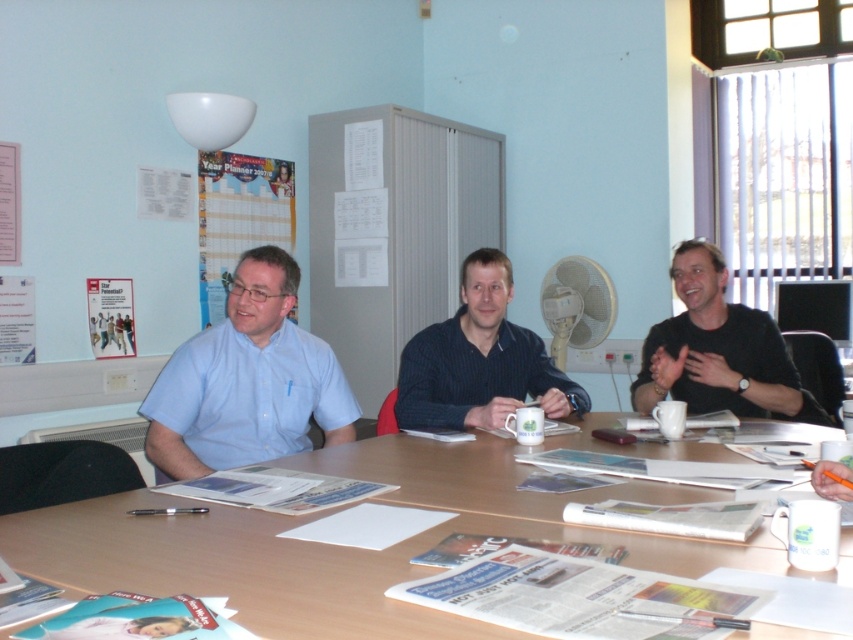
You are a photographer standing at the back of the room. You want to take a clear photo of the light blue shirt at center and the dark blue textured shirt at center. Which shirt should you focus on first to ensure both are in focus?

You should focus on the light blue shirt at center first since it is closer to the viewer than the dark blue textured shirt at center. By focusing on the closer object, both shirts will be in focus due to the depth of field.